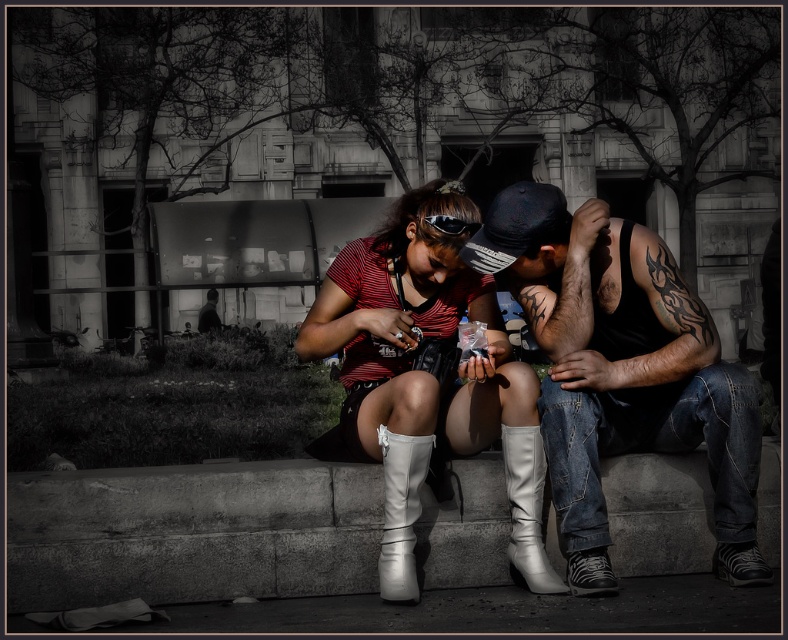
You are a photographer trying to capture a clear shot of both the black fabric baseball cap at center and the black matte goggles at center. Since both are at the center, which one is closer to the left side of the frame?

The black matte goggles at center are closer to the left side of the frame because the black fabric baseball cap at center is positioned on the right side of them.

You are a tailor measuring items for alterations. You have a measuring tape and need to determine which item, the white leather boot at center or the black fabric baseball cap at center, requires more vertical space in a storage box. Based on the scene, which item should you consider taller?

The white leather boot at center is taller than the black fabric baseball cap at center, so it requires more vertical space in the storage box.